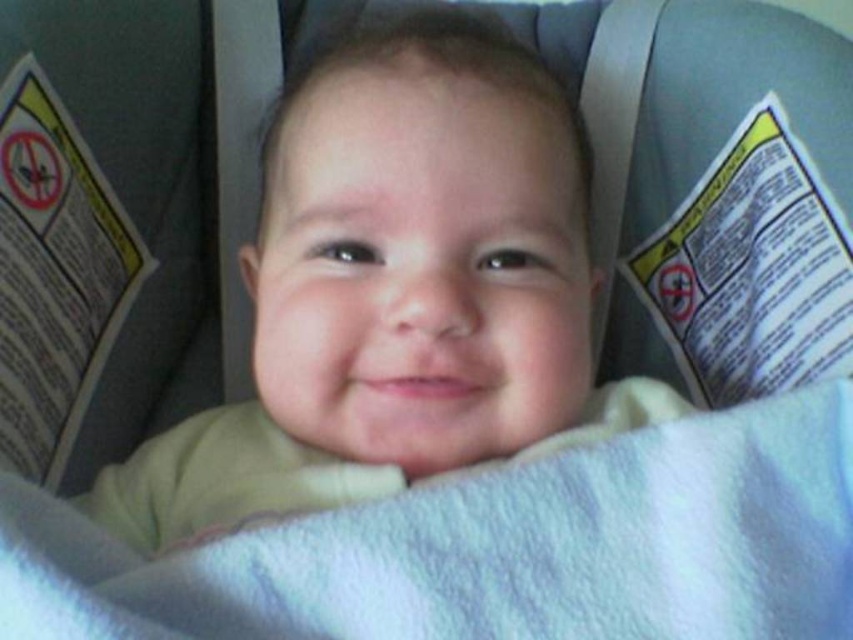
Question: Is smooth yellow shirt at center closer to camera compared to white soft blanket at center?

Choices:
 (A) yes
 (B) no

Answer: (B)

Question: Is smooth yellow shirt at center further to camera compared to white soft blanket at center?

Choices:
 (A) yes
 (B) no

Answer: (A)

Question: Among these objects, which one is farthest from the camera?

Choices:
 (A) smooth yellow shirt at center
 (B) white soft blanket at center

Answer: (A)

Question: Does smooth yellow shirt at center have a lesser width compared to white soft blanket at center?

Choices:
 (A) no
 (B) yes

Answer: (B)